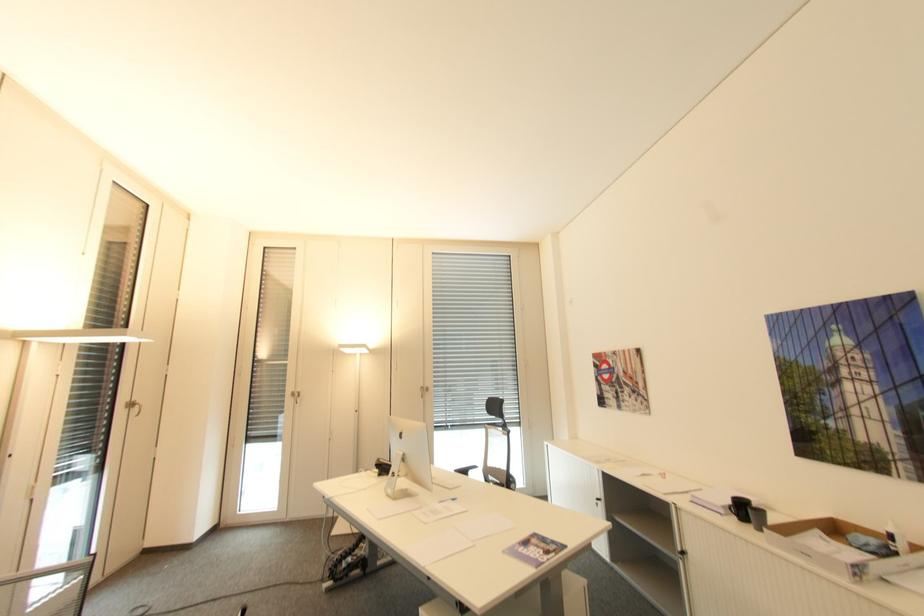
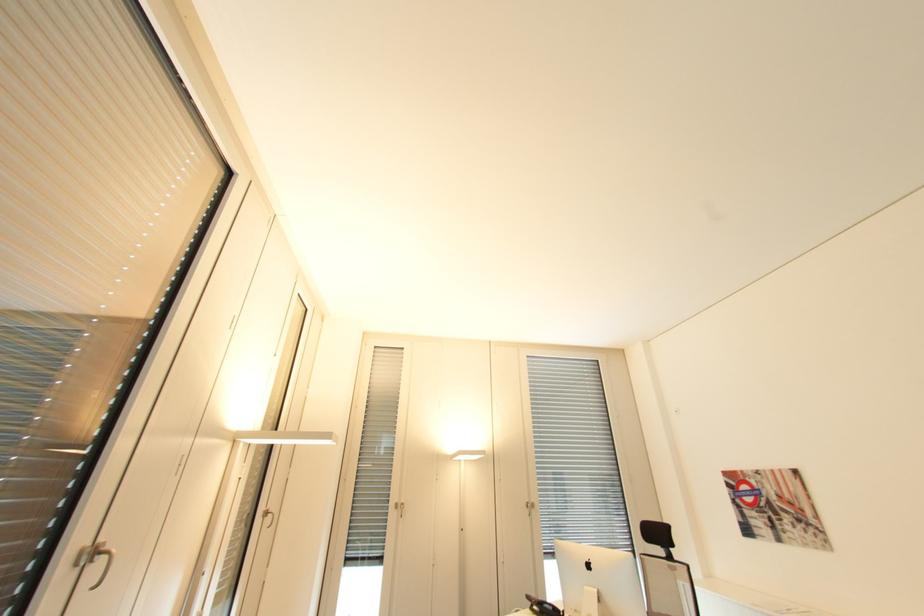
Locate, in the second image, the point that corresponds to point 304,390 in the first image.

(407, 501)